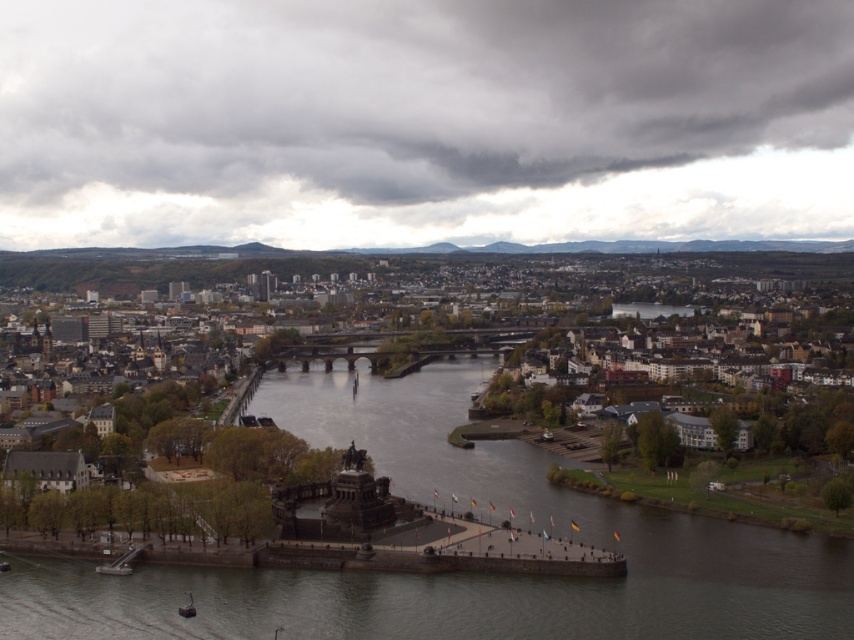
Can you confirm if brown stone buildings at center is wider than metallic gray boat at lower center?

Indeed, brown stone buildings at center has a greater width compared to metallic gray boat at lower center.

This screenshot has height=640, width=854. What do you see at coordinates (407, 420) in the screenshot? I see `brown stone buildings at center` at bounding box center [407, 420].

Does point (445, 307) come closer to viewer compared to point (185, 609)?

No, (445, 307) is further to viewer.

In order to click on brown stone buildings at center in this screenshot , I will do `click(407, 420)`.

Can you confirm if dark gray cloud at upper center is thinner than metallic gray boat at lower center?

Incorrect, dark gray cloud at upper center's width is not less than metallic gray boat at lower center's.

Which is below, dark gray cloud at upper center or metallic gray boat at lower center?

metallic gray boat at lower center is below.

Between point (472, 81) and point (179, 608), which one is positioned in front?

Positioned in front is point (179, 608).

Locate an element on the screen. The width and height of the screenshot is (854, 640). dark gray cloud at upper center is located at coordinates (407, 93).

Where is `dark gray cloud at upper center`? This screenshot has width=854, height=640. dark gray cloud at upper center is located at coordinates (407, 93).

Who is lower down, dark gray cloud at upper center or brown stone buildings at center?

Positioned lower is brown stone buildings at center.

The image size is (854, 640). What do you see at coordinates (407, 93) in the screenshot?
I see `dark gray cloud at upper center` at bounding box center [407, 93].

You are a GUI agent. You are given a task and a screenshot of the screen. Output one action in this format:
    pyautogui.click(x=<x>, y=<y>)
    Task: Click on the dark gray cloud at upper center
    This screenshot has height=640, width=854.
    Given the screenshot: What is the action you would take?
    pyautogui.click(x=407, y=93)